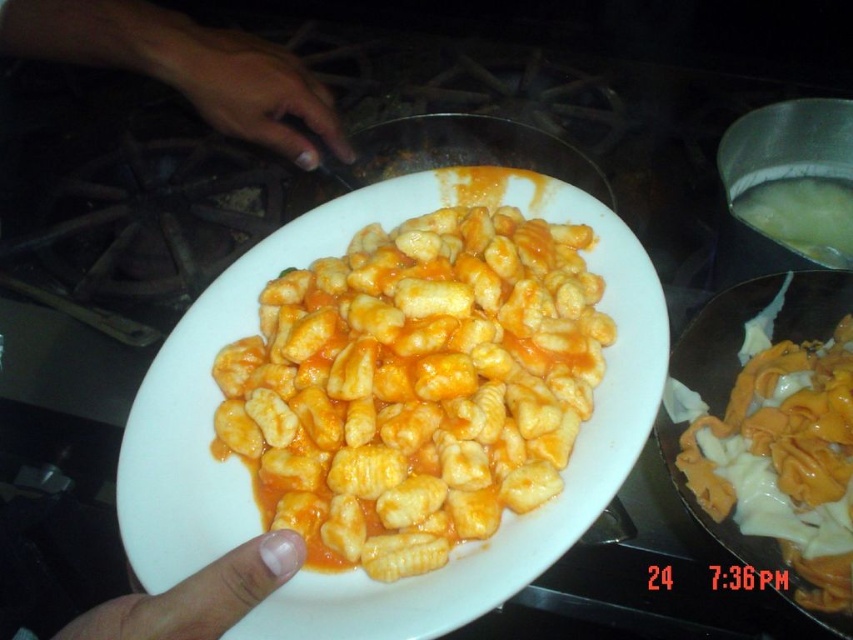
You are a food critic observing the plate of yellow matte gnocchi at center and the smooth skin hand at upper left. Which object is closer to the viewer?

The smooth skin hand at upper left is closer to the viewer than the yellow matte gnocchi at center because it is positioned above it.

You are a food critic holding a plate of gnocchi with orange sauce. You notice a yellow matte pasta at center and a smooth skin hand at center. Which object is directly touching the plate?

The yellow matte pasta at center is directly touching the plate because it is positioned under the smooth skin hand at center.

You are a chef trying to determine if the yellow matte gnocchi at center can fit under the smooth skin hand at upper left without touching the stovetop behind it. Based on their heights, will the gnocchi fit underneath the hand?

The yellow matte gnocchi at center is taller than the smooth skin hand at upper left, so placing it underneath would cause the gnocchi to touch the stovetop behind it.